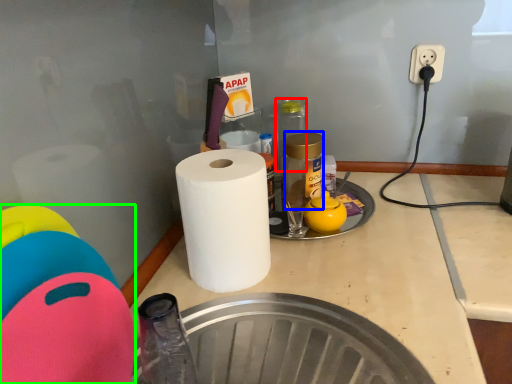
Question: Estimate the real-world distances between objects in this image. Which object is closer to bottle (highlighted by a red box), bottle (highlighted by a blue box) or toy (highlighted by a green box)?

Choices:
 (A) bottle
 (B) toy

Answer: (A)